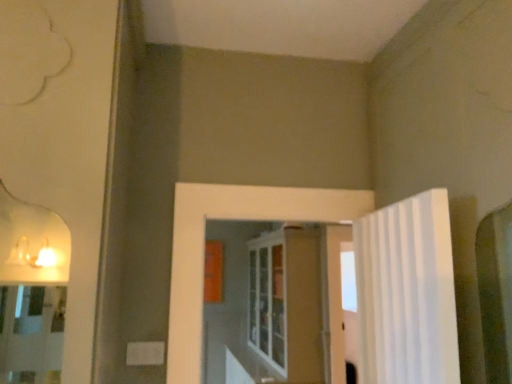
What do you see at coordinates (407, 293) in the screenshot?
I see `white striped fabric at right` at bounding box center [407, 293].

Locate an element on the screen. This screenshot has width=512, height=384. white striped fabric at right is located at coordinates (407, 293).

This screenshot has width=512, height=384. Describe the element at coordinates (287, 302) in the screenshot. I see `white glass cabinet at center` at that location.

The height and width of the screenshot is (384, 512). In order to click on white glass cabinet at center in this screenshot , I will do `click(287, 302)`.

Find the location of `white striped fabric at right`. white striped fabric at right is located at coordinates (407, 293).

Which is more to the right, white glass cabinet at center or white striped fabric at right?

white striped fabric at right is more to the right.

Does white glass cabinet at center lie in front of white striped fabric at right?

No, white glass cabinet at center is further to the viewer.

Between point (274, 253) and point (402, 319), which one is positioned in front?

The point (402, 319) is in front.

From the image's perspective, is white glass cabinet at center located above or below white striped fabric at right?

Clearly, from the image's perspective, white glass cabinet at center is below white striped fabric at right.

From a real-world perspective, is white glass cabinet at center located higher than white striped fabric at right?

Actually, white glass cabinet at center is physically below white striped fabric at right in the real world.

Considering the sizes of objects white glass cabinet at center and white striped fabric at right in the image provided, who is thinner, white glass cabinet at center or white striped fabric at right?

white striped fabric at right.

Is white glass cabinet at center shorter than white striped fabric at right?

No, white glass cabinet at center is not shorter than white striped fabric at right.

Based on their sizes in the image, would you say white glass cabinet at center is bigger or smaller than white striped fabric at right?

Clearly, white glass cabinet at center is larger in size than white striped fabric at right.

Is white glass cabinet at center spatially inside white striped fabric at right, or outside of it?

white glass cabinet at center exists outside the volume of white striped fabric at right.

Is white glass cabinet at center in contact with white striped fabric at right?

white glass cabinet at center and white striped fabric at right are clearly separated.

Is white glass cabinet at center positioned with its back to white striped fabric at right?

That's not correct — white glass cabinet at center is not looking away from white striped fabric at right.

What's the angular difference between white glass cabinet at center and white striped fabric at right's facing directions?

The angular difference between white glass cabinet at center and white striped fabric at right is 9.44 degrees.

In order to click on shower curtain in front of the white glass cabinet at center in this screenshot , I will do `click(407, 293)`.

Which is more to the left, white striped fabric at right or white glass cabinet at center?

white glass cabinet at center is more to the left.

Is white striped fabric at right in front of or behind white glass cabinet at center in the image?

In the image, white striped fabric at right appears in front of white glass cabinet at center.

Which is closer, (387, 238) or (307, 242)?

Clearly, point (387, 238) is closer to the camera than point (307, 242).

From the image's perspective, is white striped fabric at right below white glass cabinet at center?

No.

From a real-world perspective, is white striped fabric at right above or below white glass cabinet at center?

From a real-world perspective, white striped fabric at right is physically above white glass cabinet at center.

Between white striped fabric at right and white glass cabinet at center, which one has smaller width?

Thinner between the two is white striped fabric at right.

Which of these two, white striped fabric at right or white glass cabinet at center, stands taller?

Standing taller between the two is white glass cabinet at center.

Looking at this image, between white striped fabric at right and white glass cabinet at center, which one has smaller size?

Smaller between the two is white striped fabric at right.

Is white glass cabinet at center a part of white striped fabric at right?

Definitely not — white glass cabinet at center is not inside white striped fabric at right.

Are white striped fabric at right and white glass cabinet at center making contact?

They are not placed beside each other.

Is white striped fabric at right oriented towards white glass cabinet at center?

No, white striped fabric at right does not turn towards white glass cabinet at center.

How many degrees apart are the facing directions of white striped fabric at right and white glass cabinet at center?

The facing directions of white striped fabric at right and white glass cabinet at center are 9.44 degrees apart.

This screenshot has width=512, height=384. What are the coordinates of `screen door beneath the white striped fabric at right (from a real-world perspective)` in the screenshot? It's located at (287, 302).

At what (x,y) coordinates should I click in order to perform the action: click on shower curtain above the white glass cabinet at center (from the image's perspective). Please return your answer as a coordinate pair (x, y). The width and height of the screenshot is (512, 384). Looking at the image, I should click on (407, 293).

Identify the location of screen door directly beneath the white striped fabric at right (from a real-world perspective). (287, 302).